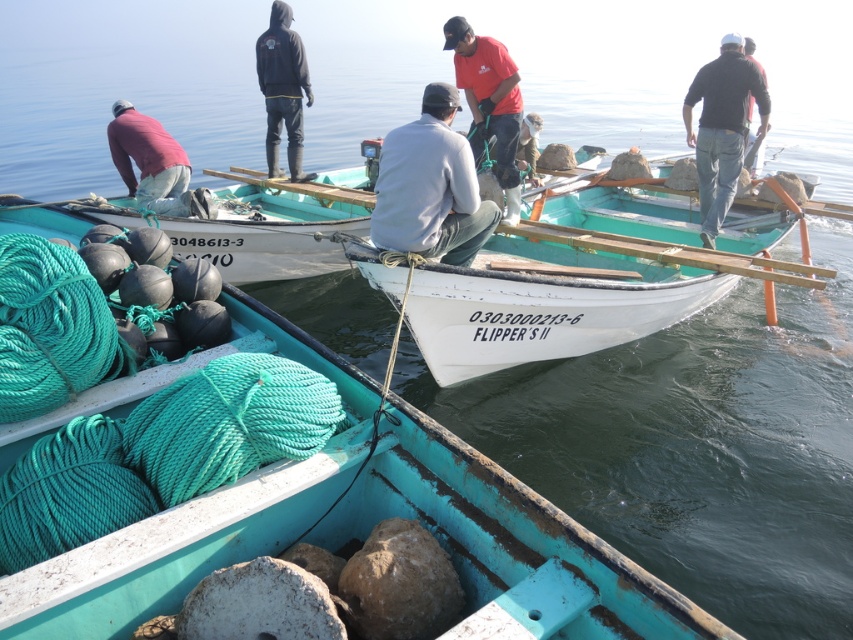
Between point (450, 157) and point (267, 118), which one is positioned behind?

Point (267, 118)

Measure the distance between gray matte shirt at center and black rubber boots at upper center.

They are 3.77 meters apart.

Locate an element on the screen. gray matte shirt at center is located at coordinates (430, 186).

Between point (471, 508) and point (502, 134), which one is positioned behind?

The point (502, 134) is behind.

Can you confirm if teal painted wood boat at center is positioned to the left of red cotton shirt at center?

Correct, you'll find teal painted wood boat at center to the left of red cotton shirt at center.

The image size is (853, 640). What do you see at coordinates (184, 500) in the screenshot? I see `teal painted wood boat at center` at bounding box center [184, 500].

The height and width of the screenshot is (640, 853). I want to click on teal painted wood boat at center, so click(184, 500).

Which of these two, dark gray sweater at upper center or black rubber boots at upper center, stands shorter?

With less height is black rubber boots at upper center.

Does dark gray sweater at upper center have a smaller size compared to black rubber boots at upper center?

Actually, dark gray sweater at upper center might be larger than black rubber boots at upper center.

Where is `dark gray sweater at upper center`? The height and width of the screenshot is (640, 853). dark gray sweater at upper center is located at coordinates (721, 128).